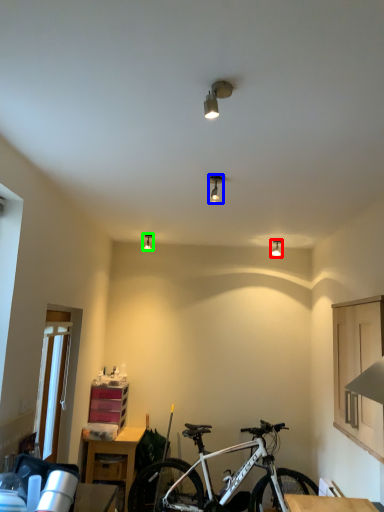
Question: Considering the real-world distances, which object is farthest from light fixture (highlighted by a red box)? light fixture (highlighted by a blue box) or light fixture (highlighted by a green box)?

Choices:
 (A) light fixture
 (B) light fixture

Answer: (A)